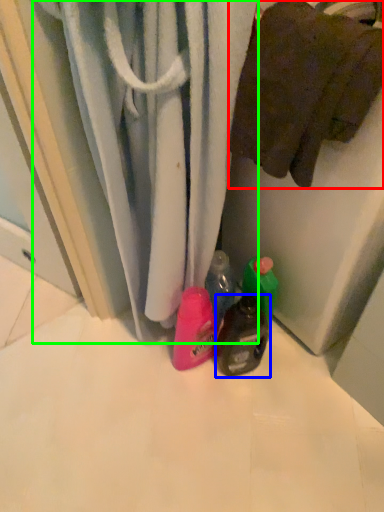
Question: Based on their relative distances, which object is nearer to towel (highlighted by a red box)? Choose from bottle (highlighted by a blue box) and curtain (highlighted by a green box).

Choices:
 (A) bottle
 (B) curtain

Answer: (B)